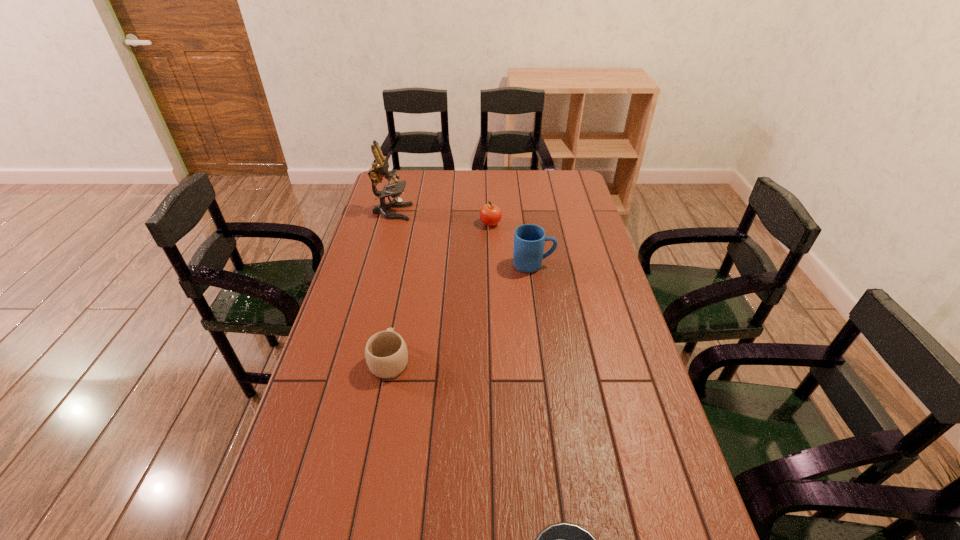
The image size is (960, 540). Identify the location of vacant point located on the side of the second nearest object with the handle. (405, 279).

Identify the location of vacant space located 0.200m on the side of the second nearest object with the handle. This screenshot has height=540, width=960. (402, 295).

I want to click on vacant region located on the side of the second nearest object with the handle, so click(408, 264).

Where is `microscope that is at the left edge`? Image resolution: width=960 pixels, height=540 pixels. microscope that is at the left edge is located at coordinates (380, 168).

Where is `mug that is at the left edge`? The width and height of the screenshot is (960, 540). mug that is at the left edge is located at coordinates 386,354.

In the image, there is a desktop. At what (x,y) coordinates should I click in order to perform the action: click on vacant space at the far edge. Please return your answer as a coordinate pair (x, y). Looking at the image, I should click on (453, 180).

In the image, there is a desktop. Find the location of `vacant space at the left edge`. vacant space at the left edge is located at coordinates (363, 234).

In the image, there is a desktop. In order to click on vacant space at the right edge in this screenshot , I will do `click(618, 349)`.

The height and width of the screenshot is (540, 960). I want to click on blank space at the far right corner of the desktop, so click(557, 193).

Find the location of a particular element. The width and height of the screenshot is (960, 540). empty space that is in between the tallest object and the right mug is located at coordinates (463, 239).